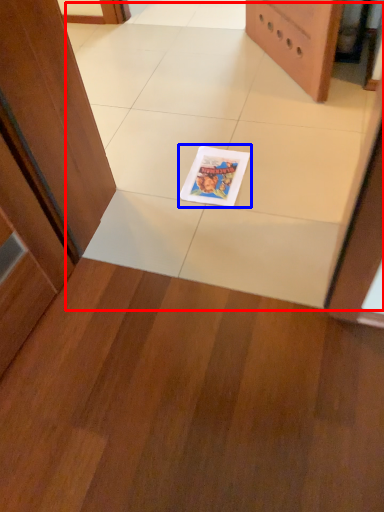
Question: Which point is further to the camera, ceramic tile (highlighted by a red box) or comic book (highlighted by a blue box)?

Choices:
 (A) ceramic tile
 (B) comic book

Answer: (B)